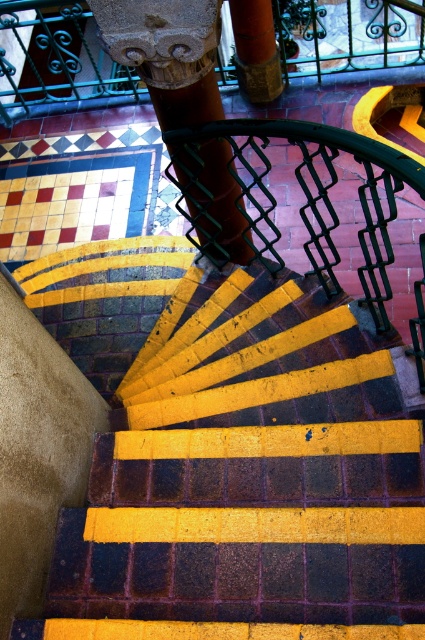
Question: Observing the image, what is the correct spatial positioning of yellow painted brick stairs at center in reference to rustic stone column at center?

Choices:
 (A) left
 (B) right

Answer: (B)

Question: Is yellow painted brick stairs at center positioned at the back of orange matte pillar at upper center?

Choices:
 (A) yes
 (B) no

Answer: (B)

Question: Which point is closer to the camera taking this photo?

Choices:
 (A) (390, 371)
 (B) (23, 96)
 (C) (257, 35)
 (D) (198, 140)

Answer: (A)

Question: Can you confirm if green wrought iron at upper center is positioned above orange matte pillar at upper center?

Choices:
 (A) yes
 (B) no

Answer: (A)

Question: Which point is closer to the camera?

Choices:
 (A) (28, 28)
 (B) (189, 1)
 (C) (243, 19)
 (D) (183, 593)

Answer: (D)

Question: Which point is farther to the camera?

Choices:
 (A) yellow painted brick stairs at center
 (B) green wrought iron at upper center
 (C) rustic stone column at center
 (D) orange matte pillar at upper center

Answer: (B)